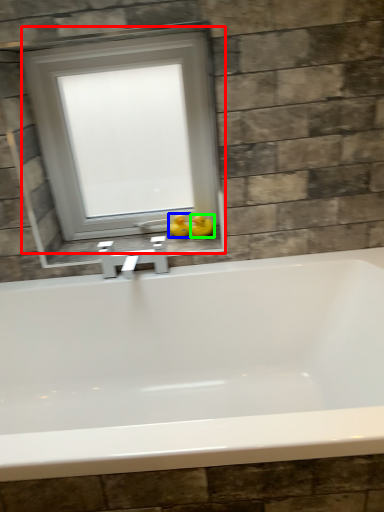
Question: Which is nearer to the window (highlighted by a red box)? duck (highlighted by a blue box) or duck (highlighted by a green box).

Choices:
 (A) duck
 (B) duck

Answer: (A)